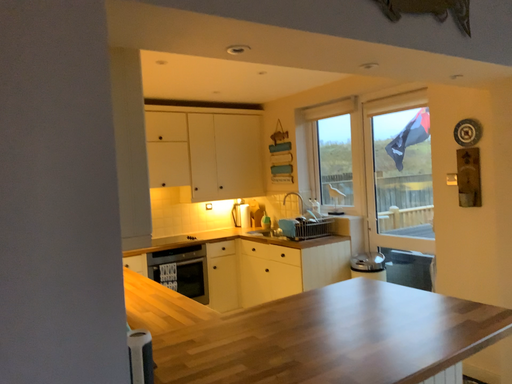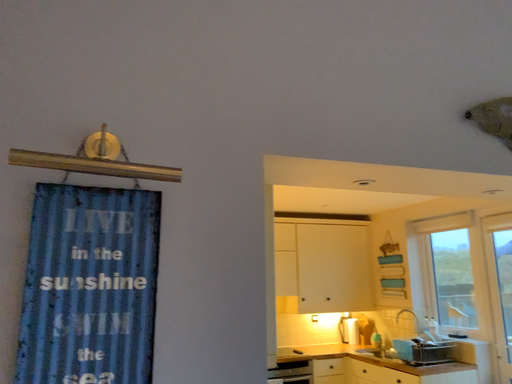
Question: Which way did the camera rotate in the video?

Choices:
 (A) rotated right
 (B) rotated left

Answer: (B)